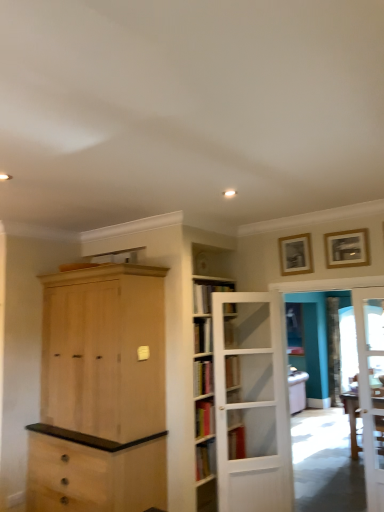
Question: Does white wooden door at center, which ranks as the second door in right-to-left order, have a greater height compared to hardcover book at center?

Choices:
 (A) no
 (B) yes

Answer: (B)

Question: Does white wooden door at center, which ranks as the second door in right-to-left order, appear on the left side of hardcover book at center?

Choices:
 (A) yes
 (B) no

Answer: (B)

Question: Is white wooden door at center, the first door when ordered from left to right, facing towards hardcover book at center?

Choices:
 (A) no
 (B) yes

Answer: (A)

Question: Is white wooden door at center, the first door when ordered from left to right, not within hardcover book at center?

Choices:
 (A) yes
 (B) no

Answer: (A)

Question: From a real-world perspective, does white wooden door at center, the first door when ordered from left to right, sit lower than hardcover book at center?

Choices:
 (A) no
 (B) yes

Answer: (B)

Question: Is point (288, 321) positioned closer to the camera than point (96, 390)?

Choices:
 (A) closer
 (B) farther

Answer: (B)

Question: Is clear glass door at center to the left or to the right of natural wood cabinet at center in the image?

Choices:
 (A) right
 (B) left

Answer: (A)

Question: Is clear glass door at center wider or thinner than natural wood cabinet at center?

Choices:
 (A) thin
 (B) wide

Answer: (A)

Question: Considering their positions, is clear glass door at center located in front of or behind natural wood cabinet at center?

Choices:
 (A) front
 (B) behind

Answer: (B)

Question: Visually, is white glass door at right, which is the 2th door from left to right, positioned to the left or to the right of white wooden door at center, which ranks as the second door in right-to-left order?

Choices:
 (A) left
 (B) right

Answer: (B)

Question: From a real-world perspective, is white glass door at right, positioned as the first door in right-to-left order, above or below white wooden door at center, which ranks as the second door in right-to-left order?

Choices:
 (A) above
 (B) below

Answer: (A)

Question: In terms of size, does white glass door at right, positioned as the first door in right-to-left order, appear bigger or smaller than white wooden door at center, the first door when ordered from left to right?

Choices:
 (A) big
 (B) small

Answer: (B)

Question: Is white glass door at right, which is the 2th door from left to right, wider or thinner than white wooden door at center, the first door when ordered from left to right?

Choices:
 (A) thin
 (B) wide

Answer: (B)

Question: Considering the positions of wooden picture frame at upper right, which is the 1th picture frame in front-to-back order, and gold wooden picture frame at upper right, which is counted as the 1th picture frame, starting from the back, in the image, is wooden picture frame at upper right, which is the 1th picture frame in front-to-back order, taller or shorter than gold wooden picture frame at upper right, which is counted as the 1th picture frame, starting from the back,?

Choices:
 (A) tall
 (B) short

Answer: (B)

Question: Considering the positions of point (349, 237) and point (311, 254), is point (349, 237) closer or farther from the camera than point (311, 254)?

Choices:
 (A) closer
 (B) farther

Answer: (A)